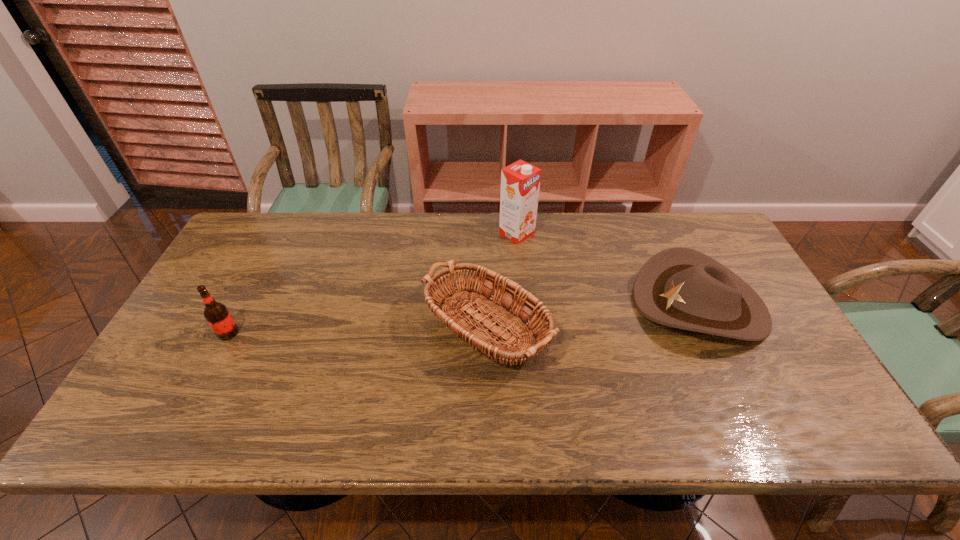
This screenshot has height=540, width=960. What are the coordinates of `empty space that is in between the basket and the leftmost object` in the screenshot? It's located at (359, 339).

Image resolution: width=960 pixels, height=540 pixels. In order to click on free space between the basket and the shortest object in this screenshot , I will do `click(595, 325)`.

You are a GUI agent. You are given a task and a screenshot of the screen. Output one action in this format:
    pyautogui.click(x=<x>, y=<y>)
    Task: Click on the empty space that is in between the leftmost object and the tallest object
    
    Given the screenshot: What is the action you would take?
    coord(372,283)

The height and width of the screenshot is (540, 960). Find the location of `free spot between the basket and the shortest object`. free spot between the basket and the shortest object is located at coordinates (595, 325).

Locate an element on the screen. The image size is (960, 540). free space that is in between the rightmost object and the basket is located at coordinates (595, 325).

Where is `empty space that is in between the cowboy hat and the carton`? The image size is (960, 540). empty space that is in between the cowboy hat and the carton is located at coordinates (608, 268).

Identify the location of object that is the second closest to the basket. (520, 181).

Select which object is the third closest to the leftmost object. Please provide its 2D coordinates. Your answer should be formatted as a tuple, i.e. [(x, y)], where the tuple contains the x and y coordinates of a point satisfying the conditions above.

[(678, 287)]

Locate an element on the screen. This screenshot has width=960, height=540. free region that satisfies the following two spatial constraints: 1. on the front side of the leftmost object; 2. on the left side of the basket is located at coordinates (222, 345).

Locate an element on the screen. The width and height of the screenshot is (960, 540). free space in the image that satisfies the following two spatial constraints: 1. on the back side of the farthest object; 2. on the left side of the leftmost object is located at coordinates (280, 233).